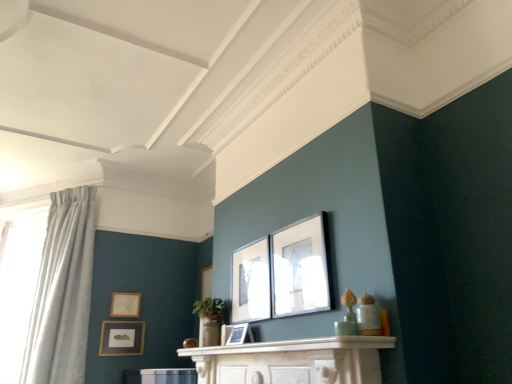
Question: Is matte black picture frame at upper center, placed as the fifth picture frame when sorted from left to right, far from matte black picture frame at lower left, placed as the 4th picture frame when sorted from right to left?

Choices:
 (A) yes
 (B) no

Answer: (A)

Question: From the image's perspective, is matte black picture frame at upper center, placed as the fifth picture frame when sorted from left to right, under matte black picture frame at lower left, which is the second picture frame from left to right?

Choices:
 (A) no
 (B) yes

Answer: (A)

Question: Considering the relative positions of matte black picture frame at upper center, the 5th picture frame positioned from the back, and matte black picture frame at lower left, the fourth picture frame positioned from the front, in the image provided, is matte black picture frame at upper center, the 5th picture frame positioned from the back, to the left of matte black picture frame at lower left, the fourth picture frame positioned from the front, from the viewer's perspective?

Choices:
 (A) no
 (B) yes

Answer: (A)

Question: Is matte black picture frame at upper center, placed as the fifth picture frame when sorted from left to right, positioned behind matte black picture frame at lower left, the fourth picture frame positioned from the front?

Choices:
 (A) yes
 (B) no

Answer: (B)

Question: Can you confirm if matte black picture frame at upper center, placed as the fifth picture frame when sorted from left to right, is shorter than matte black picture frame at lower left, which is the second picture frame from left to right?

Choices:
 (A) yes
 (B) no

Answer: (B)

Question: In terms of size, does matte gold picture frame at upper left, the first picture frame when ordered from left to right, appear bigger or smaller than light blue fabric curtain at left?

Choices:
 (A) big
 (B) small

Answer: (B)

Question: Is matte gold picture frame at upper left, which is the fifth picture frame from right to left, taller or shorter than light blue fabric curtain at left?

Choices:
 (A) tall
 (B) short

Answer: (B)

Question: From a real-world perspective, is matte gold picture frame at upper left, which is the fifth picture frame from right to left, positioned above or below light blue fabric curtain at left?

Choices:
 (A) below
 (B) above

Answer: (A)

Question: Looking at their shapes, would you say matte gold picture frame at upper left, the first picture frame when ordered from left to right, is wider or thinner than light blue fabric curtain at left?

Choices:
 (A) wide
 (B) thin

Answer: (B)

Question: In the image, is matte gold picture frame at upper left, which appears as the 1th picture frame when viewed from the back, positioned in front of or behind matte black picture frame at lower left, the 2th picture frame when ordered from back to front?

Choices:
 (A) behind
 (B) front

Answer: (A)

Question: Is matte gold picture frame at upper left, marked as the fifth picture frame in a front-to-back arrangement, taller or shorter than matte black picture frame at lower left, which is the second picture frame from left to right?

Choices:
 (A) tall
 (B) short

Answer: (B)

Question: Is point [117, 314] positioned closer to the camera than point [117, 331]?

Choices:
 (A) closer
 (B) farther

Answer: (B)

Question: Would you say matte gold picture frame at upper left, marked as the fifth picture frame in a front-to-back arrangement, is to the left or to the right of matte black picture frame at lower left, placed as the 4th picture frame when sorted from right to left, in the picture?

Choices:
 (A) right
 (B) left

Answer: (B)

Question: Do you think light blue fabric curtain at left is within white marble mantle at center, or outside of it?

Choices:
 (A) inside
 (B) outside

Answer: (B)

Question: Is light blue fabric curtain at left wider or thinner than white marble mantle at center?

Choices:
 (A) wide
 (B) thin

Answer: (A)